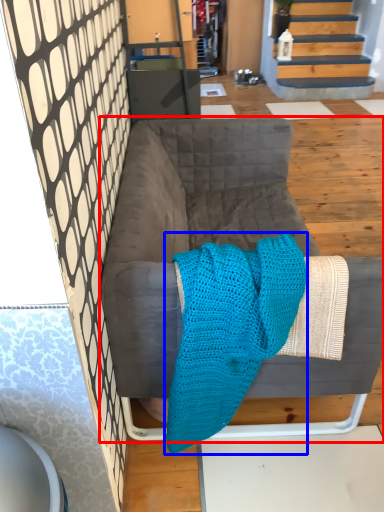
Question: Which point is closer to the camera, furniture (highlighted by a red box) or cloth (highlighted by a blue box)?

Choices:
 (A) furniture
 (B) cloth

Answer: (B)